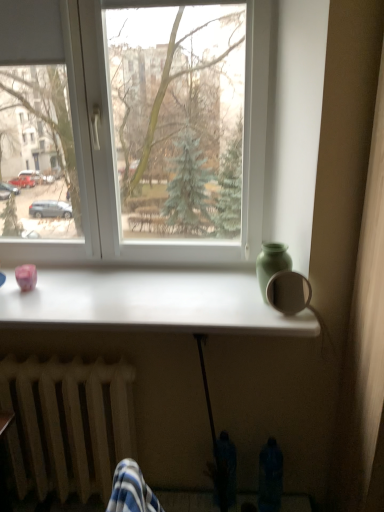
Question: Does point (19, 303) appear closer or farther from the camera than point (8, 440)?

Choices:
 (A) closer
 (B) farther

Answer: (B)

Question: From their relative heights in the image, would you say white glossy table at center is taller or shorter than wooden radiator at lower left?

Choices:
 (A) tall
 (B) short

Answer: (B)

Question: Which object is the closest to the white plastic window at center?

Choices:
 (A) wooden radiator at lower left
 (B) white glossy table at center
 (C) green matte vase at upper right

Answer: (B)

Question: Which of these objects is positioned farthest from the wooden radiator at lower left?

Choices:
 (A) white plastic window at center
 (B) white glossy table at center
 (C) green matte vase at upper right

Answer: (C)